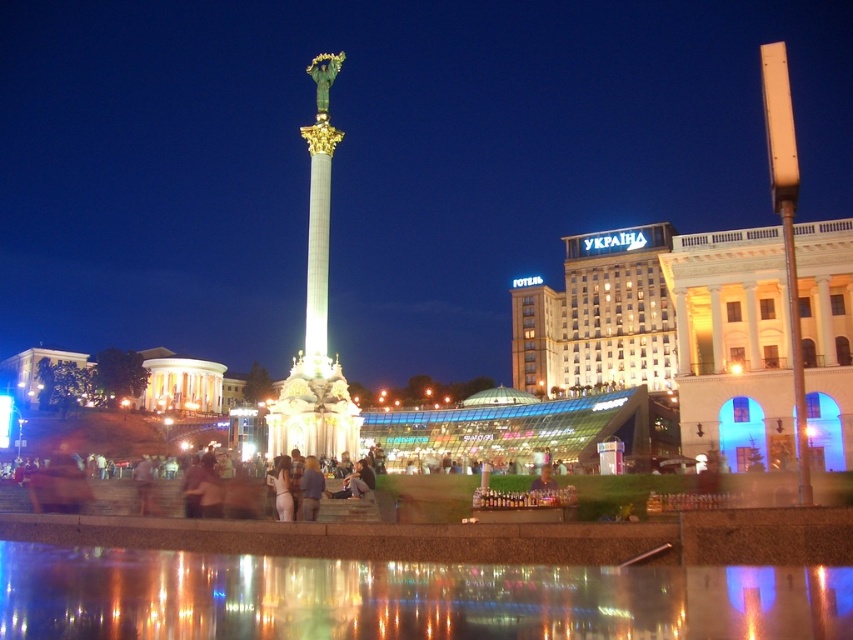
You are standing in the public square looking at the monument. The monument has a shiny gold column at its center. If you want to take a photo of the monument from a distance where the shiny gold column at center is clearly visible but not too close, would 200 feet away be a suitable distance?

The shiny gold column at center is 198.97 feet from the viewer. Since 200 feet is slightly further than the current distance, moving back a little more would ensure the column is visible but not too close.

You are a photographer standing in the plaza and want to capture both the transparent glass water at lower center and the smooth skin face at center in a single shot. Which object will appear shorter in the photo?

The transparent glass water at lower center will appear shorter in the photo because it has a lesser height compared to the smooth skin face at center.